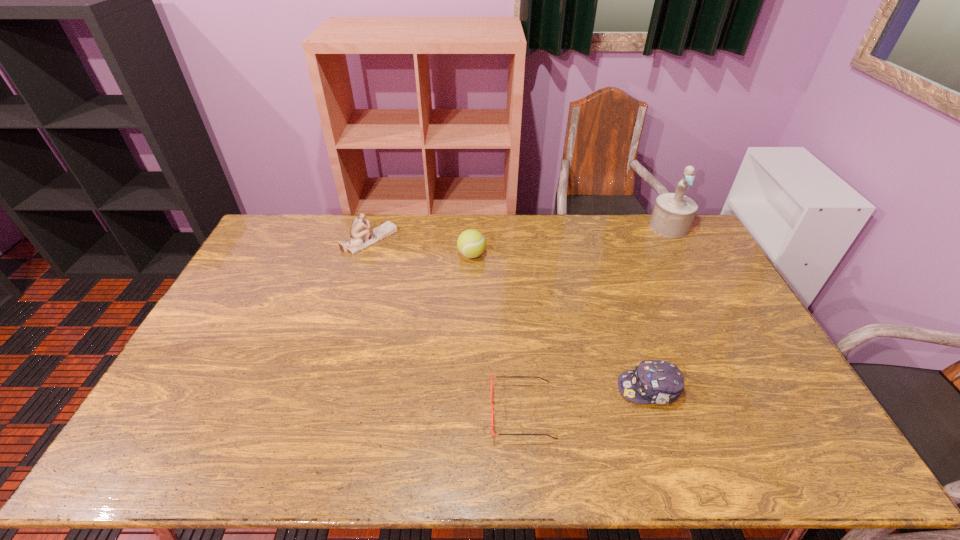
Locate an element on the screen. blank space located at the beak of the tallest object is located at coordinates (701, 285).

Locate an element on the screen. The image size is (960, 540). free location located on the front-facing side of the shorter figurine is located at coordinates (431, 239).

Identify the location of blank space located on the front of the third shortest object. This screenshot has height=540, width=960. (471, 279).

At what (x,y) coordinates should I click in order to perform the action: click on free space located on the front-facing side of the second shortest object. Please return your answer as a coordinate pair (x, y). The image size is (960, 540). Looking at the image, I should click on pos(569,389).

Where is `vacant region located on the front-facing side of the second shortest object`? vacant region located on the front-facing side of the second shortest object is located at coordinates (532, 389).

Where is `blank area located 0.320m on the front-facing side of the second shortest object`? Image resolution: width=960 pixels, height=540 pixels. blank area located 0.320m on the front-facing side of the second shortest object is located at coordinates (499, 389).

I want to click on vacant space located on the front-facing side of the shortest object, so click(x=371, y=411).

In order to click on vacant space situated on the front-facing side of the shortest object in this screenshot , I will do `click(464, 411)`.

The width and height of the screenshot is (960, 540). Find the location of `blank space located 0.300m on the front-facing side of the shortest object`. blank space located 0.300m on the front-facing side of the shortest object is located at coordinates (374, 411).

Where is `tennis ball at the far edge`? This screenshot has width=960, height=540. tennis ball at the far edge is located at coordinates (471, 243).